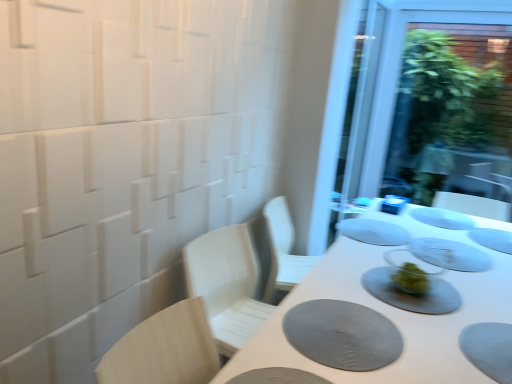
Image resolution: width=512 pixels, height=384 pixels. I want to click on free area behind clear glass plate at center, the fifth tableware positioned from the back, so click(x=412, y=228).